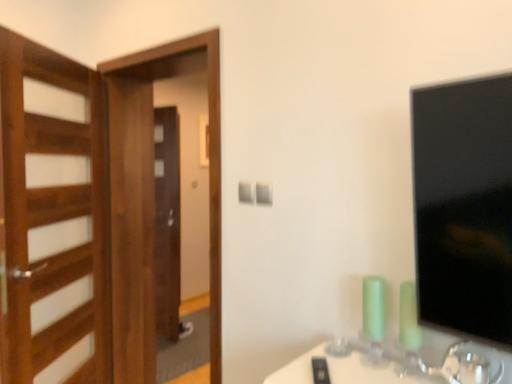
Question: From the image's perspective, relative to wooden door at left, is wooden screen door at left above or below?

Choices:
 (A) above
 (B) below

Answer: (B)

Question: Is wooden screen door at left taller or shorter than wooden door at left?

Choices:
 (A) tall
 (B) short

Answer: (A)

Question: From a real-world perspective, is wooden screen door at left above or below wooden door at left?

Choices:
 (A) below
 (B) above

Answer: (A)

Question: From the image's perspective, is wooden door at left above or below wooden screen door at left?

Choices:
 (A) above
 (B) below

Answer: (A)

Question: Which is correct: wooden door at left is inside wooden screen door at left, or outside of it?

Choices:
 (A) inside
 (B) outside

Answer: (B)

Question: Looking at their shapes, would you say wooden door at left is wider or thinner than wooden screen door at left?

Choices:
 (A) wide
 (B) thin

Answer: (B)

Question: Considering the positions of point 10,124 and point 215,269, is point 10,124 closer or farther from the camera than point 215,269?

Choices:
 (A) farther
 (B) closer

Answer: (B)